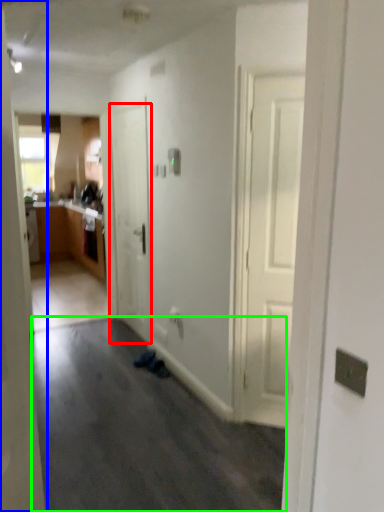
Question: Considering the real-world distances, which object is closest to door (highlighted by a red box)? door (highlighted by a blue box) or plain (highlighted by a green box).

Choices:
 (A) door
 (B) plain

Answer: (B)